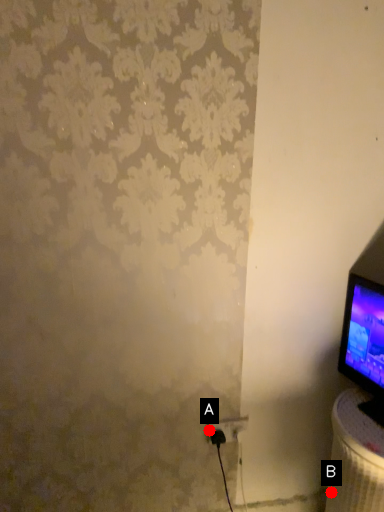
Question: Two points are circled on the image, labeled by A and B beside each circle. Among these points, which one is nearest to the camera?

Choices:
 (A) A is closer
 (B) B is closer

Answer: (B)